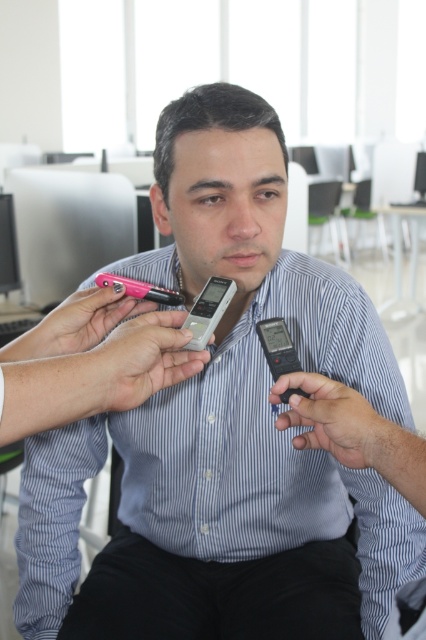
Who is shorter, black cotton pants at lower center or black plastic smartphone at center?

Standing shorter between the two is black plastic smartphone at center.

Between black cotton pants at lower center and black plastic smartphone at center, which one has more height?

With more height is black cotton pants at lower center.

This screenshot has width=426, height=640. I want to click on black cotton pants at lower center, so click(x=216, y=595).

Image resolution: width=426 pixels, height=640 pixels. In order to click on black cotton pants at lower center in this screenshot , I will do `click(216, 595)`.

Between point (281, 346) and point (126, 282), which one is positioned behind?

The point (126, 282) is more distant.

Who is more forward, (270, 333) or (175, 301)?

Point (270, 333)

Find the location of a particular element. black plastic smartphone at center is located at coordinates (278, 346).

Does silver metallic smartphone at center appear on the right side of black plastic smartphone at center?

In fact, silver metallic smartphone at center is to the left of black plastic smartphone at center.

This screenshot has width=426, height=640. What do you see at coordinates (207, 310) in the screenshot?
I see `silver metallic smartphone at center` at bounding box center [207, 310].

Does point (227, 304) come closer to viewer compared to point (302, 396)?

No, it is not.

Locate an element on the screen. Image resolution: width=426 pixels, height=640 pixels. silver metallic smartphone at center is located at coordinates (207, 310).